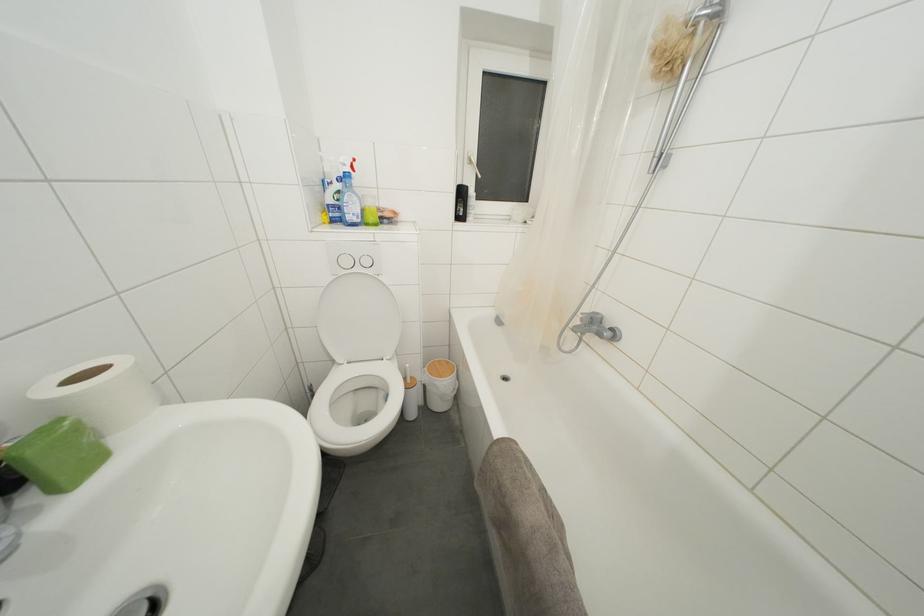
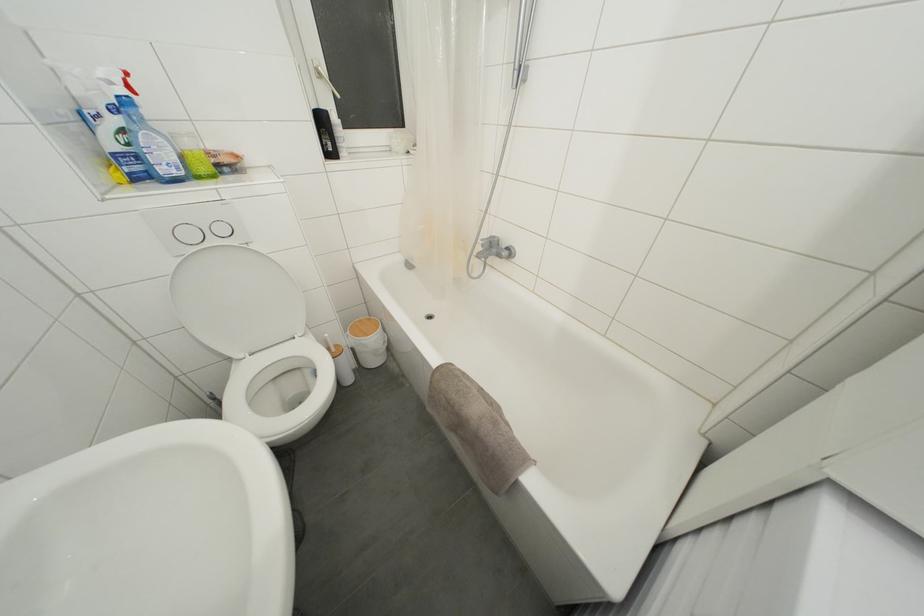
Find the pixel in the second image that matches point 475,167 in the first image.

(323, 79)